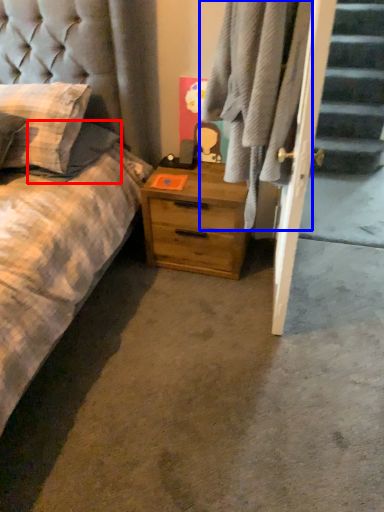
Question: Which point is closer to the camera, pillow (highlighted by a red box) or plaid (highlighted by a blue box)?

Choices:
 (A) pillow
 (B) plaid

Answer: (B)